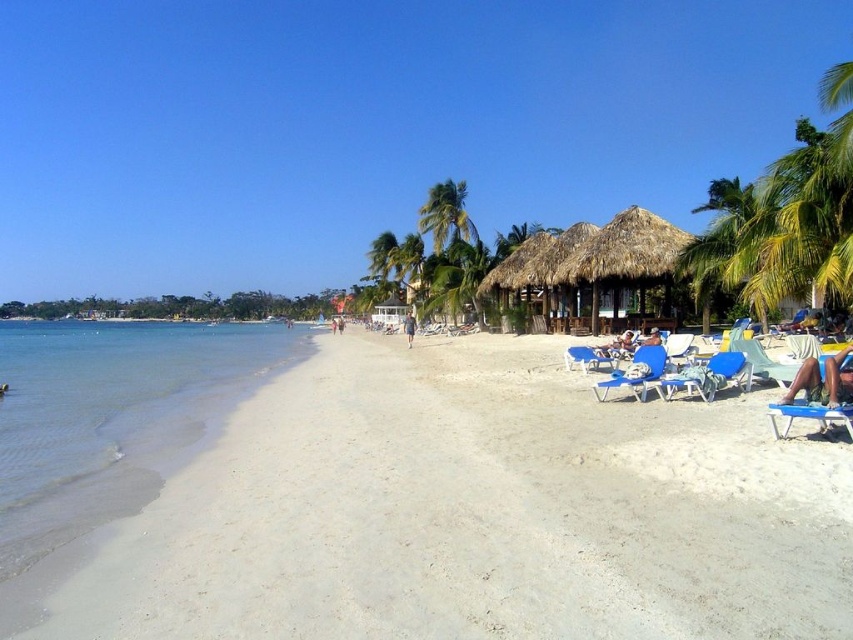
Does clear water at left appear on the left side of tan skin person at lower right?

Correct, you'll find clear water at left to the left of tan skin person at lower right.

Find the location of a particular element. The width and height of the screenshot is (853, 640). clear water at left is located at coordinates (112, 416).

Which of these two, blue fabric beach chair at lower right or light blue fabric person at center, stands taller?

light blue fabric person at center is taller.

Which is above, blue fabric beach chair at lower right or light blue fabric person at center?

light blue fabric person at center

At what (x,y) coordinates should I click in order to perform the action: click on blue fabric beach chair at lower right. Please return your answer as a coordinate pair (x, y). Image resolution: width=853 pixels, height=640 pixels. Looking at the image, I should click on (709, 376).

Can you confirm if white sand beach at lower left is positioned to the right of blue plastic chair at lower right?

No, white sand beach at lower left is not to the right of blue plastic chair at lower right.

Is point (756, 536) farther from viewer compared to point (610, 342)?

No, (756, 536) is in front of (610, 342).

Image resolution: width=853 pixels, height=640 pixels. In order to click on white sand beach at lower left in this screenshot , I will do `click(477, 513)`.